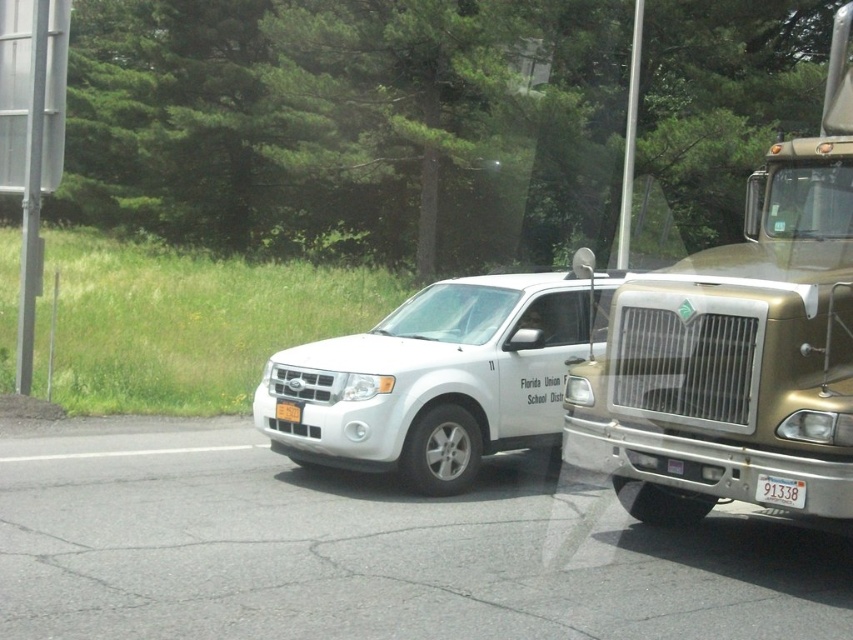
Question: Can you confirm if gold metallic truck at right is positioned above yellow matte license plate at center?

Choices:
 (A) yes
 (B) no

Answer: (A)

Question: Among these points, which one is nearest to the camera?

Choices:
 (A) (573, 289)
 (B) (850, 228)
 (C) (288, 403)
 (D) (786, 499)

Answer: (D)

Question: Which object is the closest to the yellow matte license plate at center?

Choices:
 (A) gold metallic truck at right
 (B) white plastic license plate at center

Answer: (B)

Question: Is gold metallic truck at right above white plastic license plate at center?

Choices:
 (A) no
 (B) yes

Answer: (B)

Question: Which object is closer to the camera taking this photo?

Choices:
 (A) yellow matte license plate at center
 (B) white matte suv at center
 (C) gold metallic truck at right
 (D) white plastic license plate at center

Answer: (C)

Question: Is white plastic license plate at center below yellow matte license plate at center?

Choices:
 (A) no
 (B) yes

Answer: (B)